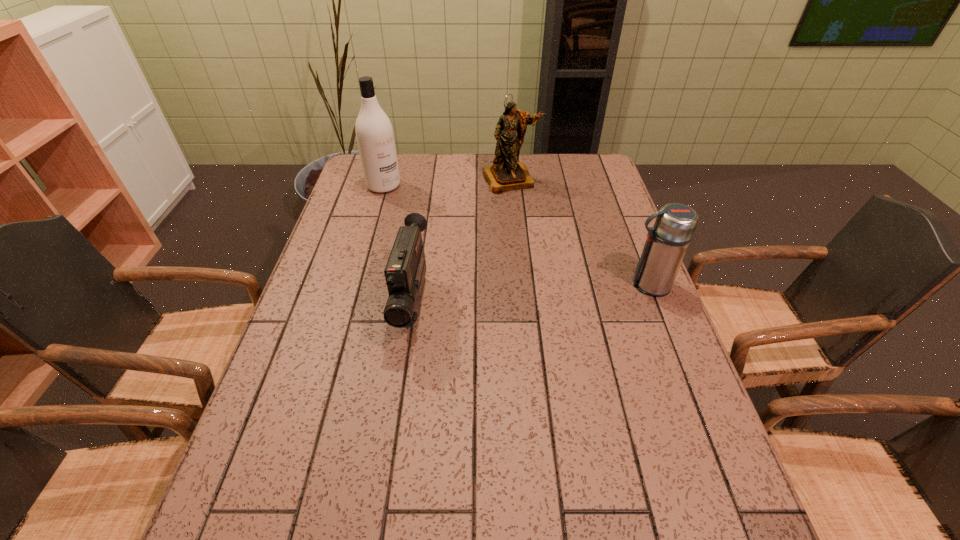
Where is `free location located with a handle on the side of the thermos bottle`? The width and height of the screenshot is (960, 540). free location located with a handle on the side of the thermos bottle is located at coordinates (540, 285).

Locate an element on the screen. The image size is (960, 540). free space located 0.370m with a handle on the side of the thermos bottle is located at coordinates pos(488,285).

Locate an element on the screen. The height and width of the screenshot is (540, 960). vacant space located on the front-facing side of the figurine is located at coordinates (525, 209).

This screenshot has height=540, width=960. Identify the location of vacant space located on the front-facing side of the figurine. (542, 244).

Image resolution: width=960 pixels, height=540 pixels. Identify the location of free space located on the front-facing side of the figurine. (540, 238).

You are a GUI agent. You are given a task and a screenshot of the screen. Output one action in this format:
    pyautogui.click(x=<x>, y=<y>)
    Task: Click on the blank space located 0.170m on the front-facing side of the tallest object
    The image size is (960, 540).
    Given the screenshot: What is the action you would take?
    pyautogui.click(x=420, y=217)

Identify the location of vacant space positioned 0.250m on the front-facing side of the tallest object. The height and width of the screenshot is (540, 960). (434, 228).

Image resolution: width=960 pixels, height=540 pixels. Find the location of `free space located 0.080m on the front-facing side of the tallest object`. free space located 0.080m on the front-facing side of the tallest object is located at coordinates (404, 204).

This screenshot has width=960, height=540. I want to click on figurine that is positioned at the far edge, so click(506, 174).

You are a GUI agent. You are given a task and a screenshot of the screen. Output one action in this format:
    pyautogui.click(x=<x>, y=<y>)
    Task: Click on the shampoo that is at the far edge
    
    Given the screenshot: What is the action you would take?
    pyautogui.click(x=374, y=132)